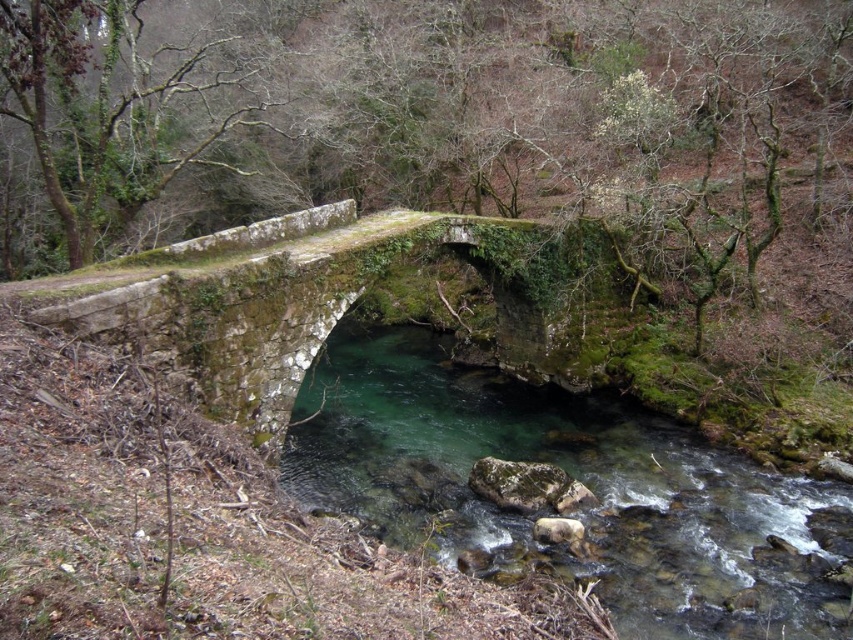
You are standing on a viewing platform 10 meters away from the green stone river at center. Can you safely walk towards the river without crossing the bridge?

The green stone river at center is 9.10 meters away from the camera. Since you are standing on a viewing platform 10 meters away, you can safely walk towards the river without crossing the bridge as the distance is within a safe range.